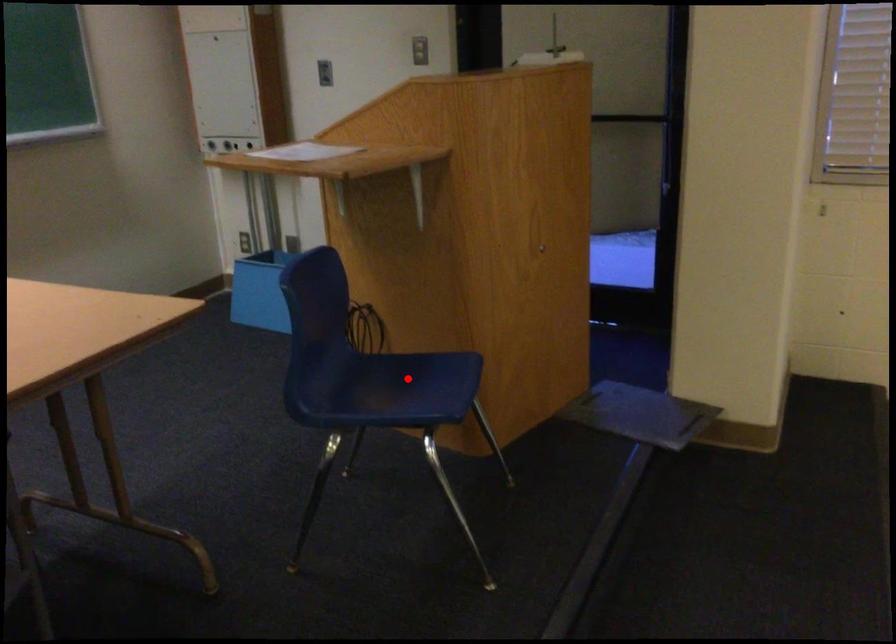
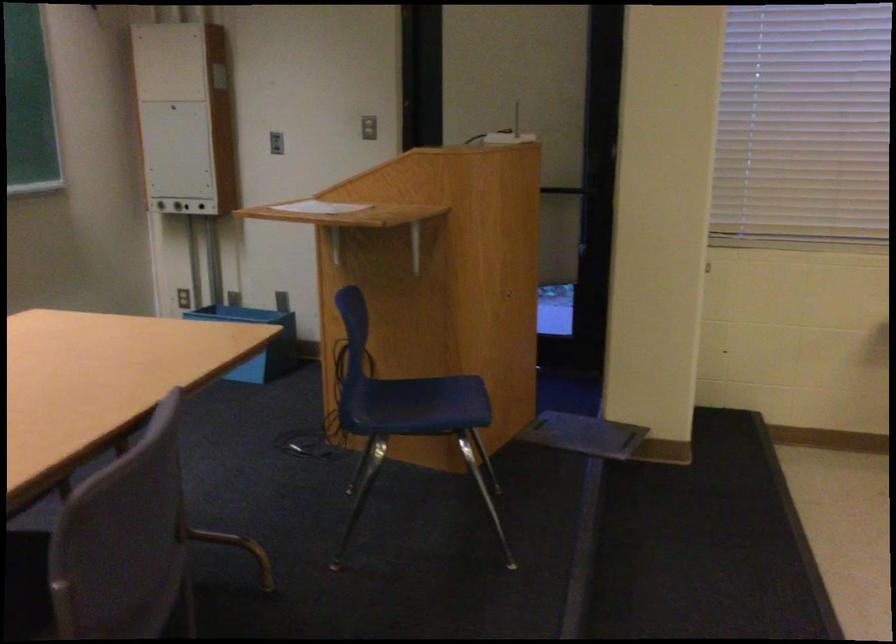
Question: I am providing you with two images of the same scene from different viewpoints. Given a red point in image1, look at the same physical point in image2. Is it:

Choices:
 (A) Closer to the viewpoint
 (B) Farther from the viewpoint

Answer: (B)